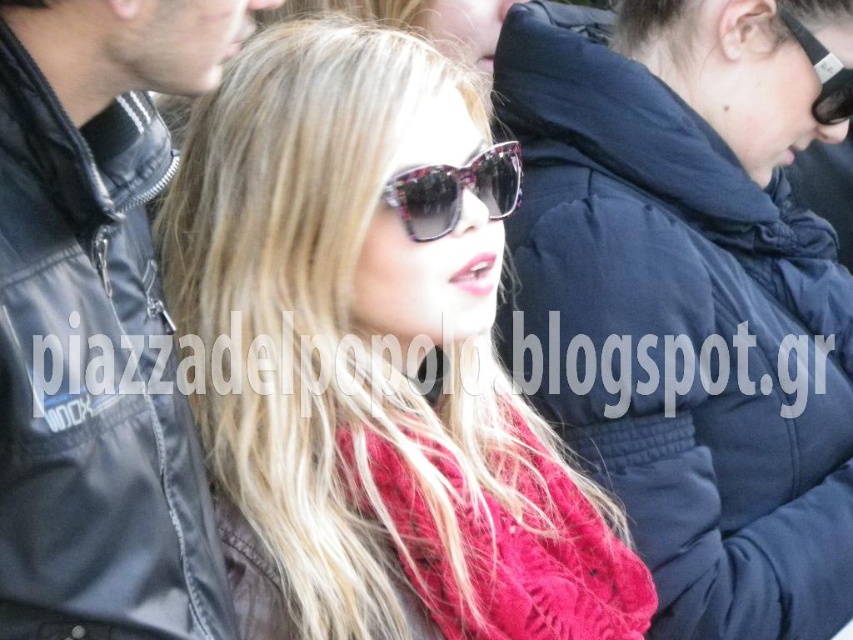
Question: Which of the following is the farthest from the observer?

Choices:
 (A) (485, 314)
 (B) (460, 196)

Answer: (A)

Question: Which object is closer to the camera taking this photo?

Choices:
 (A) knitted red scarf at center
 (B) black plastic sunglasses at upper right
 (C) matte black jacket at center
 (D) black leather jacket at left

Answer: (D)

Question: Can you confirm if matte black jacket at center is bigger than dark blue puffer jacket at upper right?

Choices:
 (A) yes
 (B) no

Answer: (B)

Question: Does matte black jacket at center have a lesser width compared to black leather jacket at left?

Choices:
 (A) yes
 (B) no

Answer: (B)

Question: Can you confirm if black leather jacket at left is positioned above shiny floral-patterned sunglasses at center?

Choices:
 (A) no
 (B) yes

Answer: (A)

Question: Among these objects, which one is farthest from the camera?

Choices:
 (A) black plastic sunglasses at upper right
 (B) dark blue puffer jacket at upper right

Answer: (A)